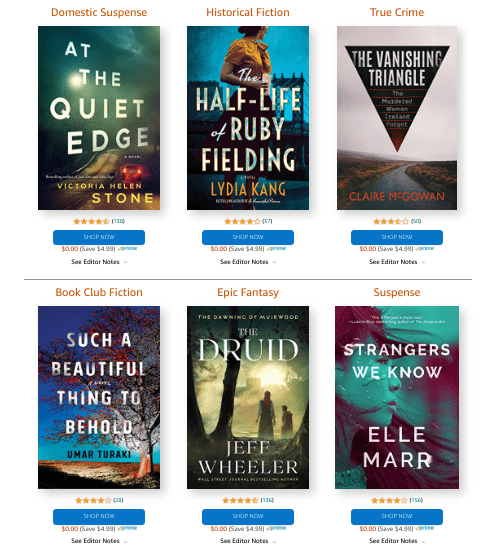
Locate an element on the screen. The width and height of the screenshot is (495, 552). books is located at coordinates (409, 421), (248, 412), (118, 386), (99, 160), (263, 145), (361, 143).